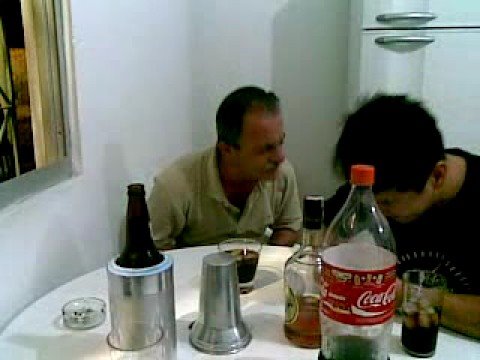
Identify the location of bottles. This screenshot has height=360, width=480. (133, 231), (308, 241), (358, 261).